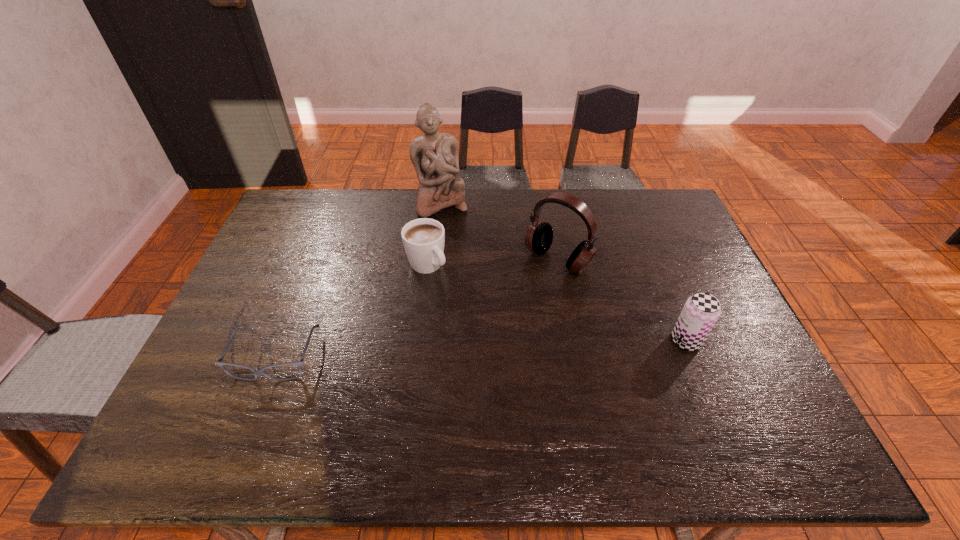
Image resolution: width=960 pixels, height=540 pixels. In order to click on vacant spot on the desktop that is between the leftmost object and the rightmost object and is positioned on the ear pads of the headset in this screenshot , I will do `click(469, 349)`.

Where is `free spot on the desktop that is between the shortest object and the rightmost object and is positioned on the front-facing side of the tallest object`? This screenshot has height=540, width=960. free spot on the desktop that is between the shortest object and the rightmost object and is positioned on the front-facing side of the tallest object is located at coordinates (492, 348).

What are the coordinates of `vacant space on the desktop that is between the spectacles and the third shortest object and is positioned with the handle on the side of the second shortest object` in the screenshot? It's located at (510, 348).